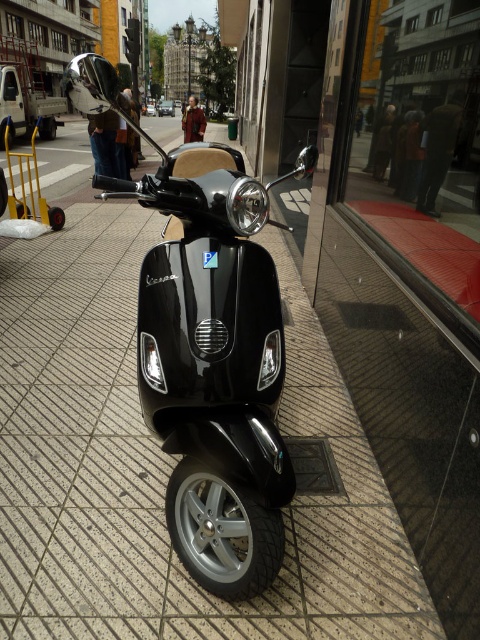
Between glossy black scooter at center and red glass window at center, which one is positioned higher?

red glass window at center

Can you confirm if glossy black scooter at center is shorter than red glass window at center?

Yes, glossy black scooter at center is shorter than red glass window at center.

Between point (223, 522) and point (367, 140), which one is positioned in front?

Point (223, 522) is in front.

Where is `glossy black scooter at center`? Image resolution: width=480 pixels, height=640 pixels. glossy black scooter at center is located at coordinates (215, 368).